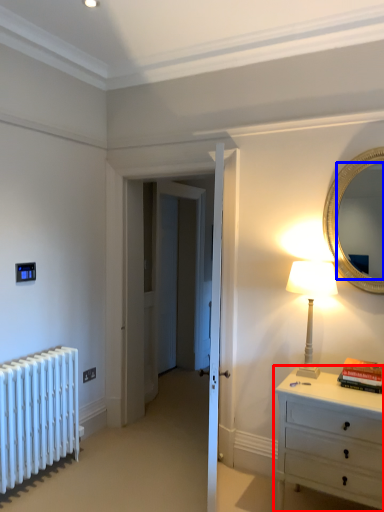
Question: Which object appears closest to the camera in this image, chest of drawers (highlighted by a red box) or mirror (highlighted by a blue box)?

Choices:
 (A) chest of drawers
 (B) mirror

Answer: (A)